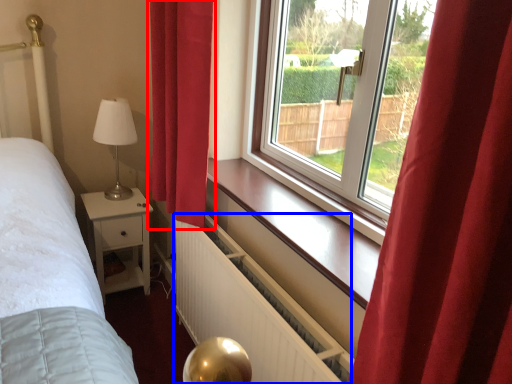
Question: Which point is further to the camera, curtain (highlighted by a red box) or radiator (highlighted by a blue box)?

Choices:
 (A) curtain
 (B) radiator

Answer: (A)